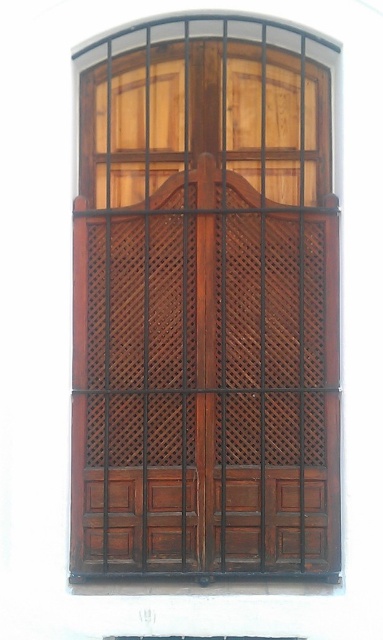
Question: Which of the following is the closest to the observer?

Choices:
 (A) (271, 413)
 (B) (279, 593)

Answer: (B)

Question: Is wooden door at center to the left of wooden at lower center from the viewer's perspective?

Choices:
 (A) no
 (B) yes

Answer: (B)

Question: Which object appears closest to the camera in this image?

Choices:
 (A) wooden door at center
 (B) wooden at lower center

Answer: (B)

Question: Can you confirm if wooden door at center is positioned below wooden at lower center?

Choices:
 (A) no
 (B) yes

Answer: (A)

Question: Is wooden door at center in front of wooden at lower center?

Choices:
 (A) yes
 (B) no

Answer: (B)

Question: Which point is closer to the camera?

Choices:
 (A) wooden door at center
 (B) wooden at lower center

Answer: (B)